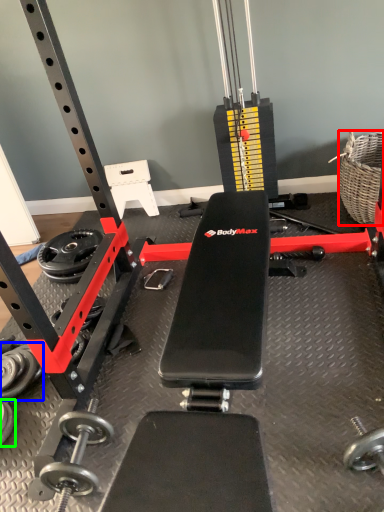
Question: Considering the real-world distances, which object is closest to basket (highlighted by a red box)? dumbbell (highlighted by a blue box) or dumbbell (highlighted by a green box).

Choices:
 (A) dumbbell
 (B) dumbbell

Answer: (A)